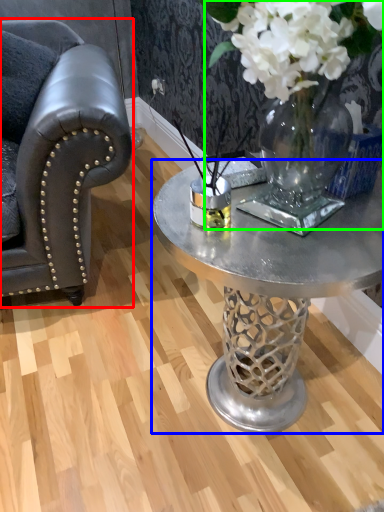
Question: Which is farther away from chair (highlighted by a red box)? coffee table (highlighted by a blue box) or floral arrangement (highlighted by a green box)?

Choices:
 (A) coffee table
 (B) floral arrangement

Answer: (B)